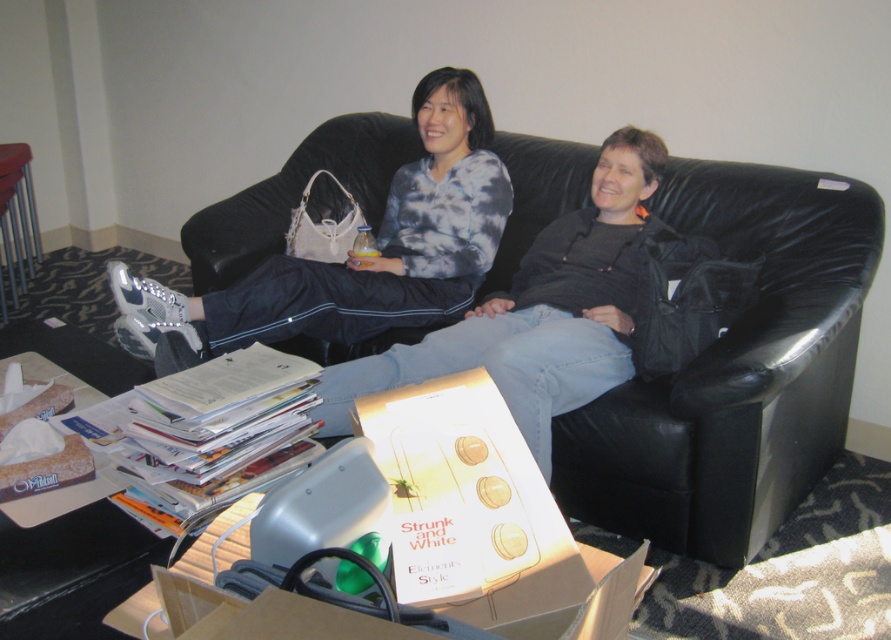
Question: Is the position of matte gray sweatpants at center less distant than that of cardboard box at lower center?

Choices:
 (A) yes
 (B) no

Answer: (B)

Question: Which of the following is the closest to the observer?

Choices:
 (A) pyautogui.click(x=773, y=499)
 (B) pyautogui.click(x=491, y=179)
 (C) pyautogui.click(x=451, y=449)

Answer: (C)

Question: Does matte gray sweatpants at center come in front of cardboard box at lower center?

Choices:
 (A) no
 (B) yes

Answer: (A)

Question: Which of these objects is positioned farthest from the black leather couch at center?

Choices:
 (A) cardboard box at lower center
 (B) matte gray sweatpants at center

Answer: (A)

Question: Does matte gray sweatpants at center appear over cardboard box at lower center?

Choices:
 (A) yes
 (B) no

Answer: (A)

Question: Among these objects, which one is farthest from the camera?

Choices:
 (A) black leather couch at center
 (B) matte gray sweatpants at center
 (C) cardboard box at lower center

Answer: (B)